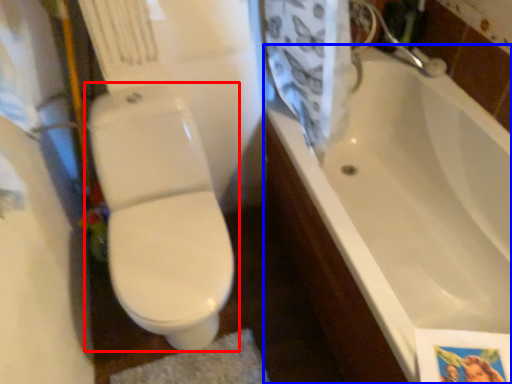
Question: Which point is further to the camera, toilet (highlighted by a red box) or bathtub (highlighted by a blue box)?

Choices:
 (A) toilet
 (B) bathtub

Answer: (A)